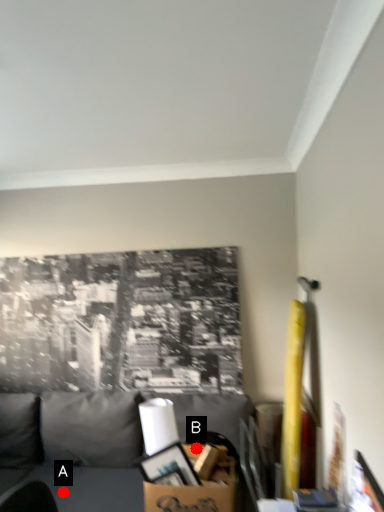
Question: Two points are circled on the image, labeled by A and B beside each circle. Among these points, which one is nearest to the camera?

Choices:
 (A) A is closer
 (B) B is closer

Answer: (B)